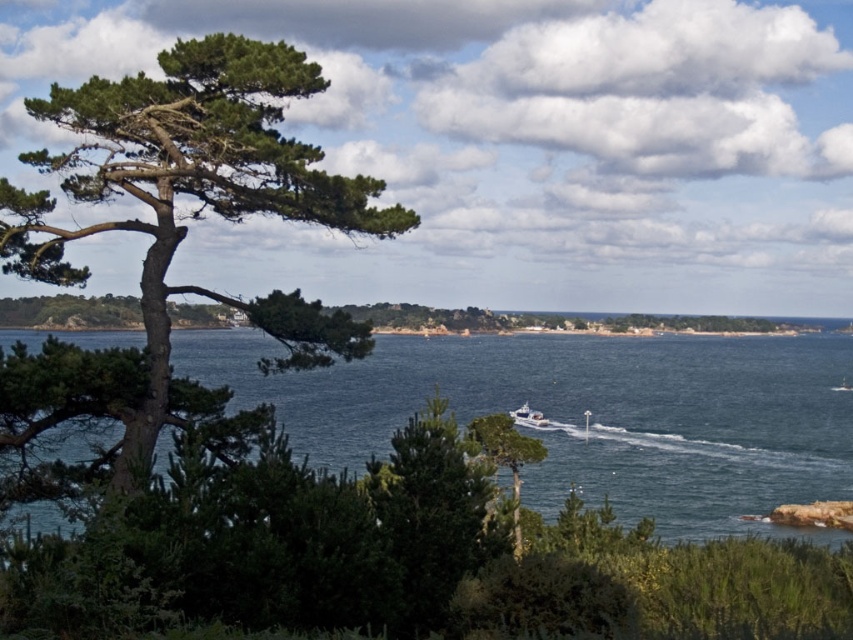
Does blue water at center appear on the right side of green matte tree at center?

In fact, blue water at center is to the left of green matte tree at center.

Describe the element at coordinates (590, 416) in the screenshot. The height and width of the screenshot is (640, 853). I see `blue water at center` at that location.

Looking at this image, who is more forward, (384, 419) or (537, 445)?

Point (537, 445) is more forward.

You are a GUI agent. You are given a task and a screenshot of the screen. Output one action in this format:
    pyautogui.click(x=<x>, y=<y>)
    Task: Click on the blue water at center
    The width and height of the screenshot is (853, 640).
    Given the screenshot: What is the action you would take?
    590,416

Can you confirm if green matte tree at center is bigger than white glossy boat at center?

Yes.

Is green matte tree at center wider than white glossy boat at center?

No, green matte tree at center is not wider than white glossy boat at center.

Does point (502, 465) come closer to viewer compared to point (540, 428)?

Yes, it is.

This screenshot has width=853, height=640. Find the location of `green matte tree at center`. green matte tree at center is located at coordinates (505, 456).

Consider the image. Is blue water at center shorter than green rough bark tree at left?

No.

Consider the image. Is the position of blue water at center less distant than that of green rough bark tree at left?

That is False.

Who is more distant from viewer, (763, 410) or (186, 99)?

The point (763, 410) is behind.

Find the location of `blue water at center`. blue water at center is located at coordinates (590, 416).